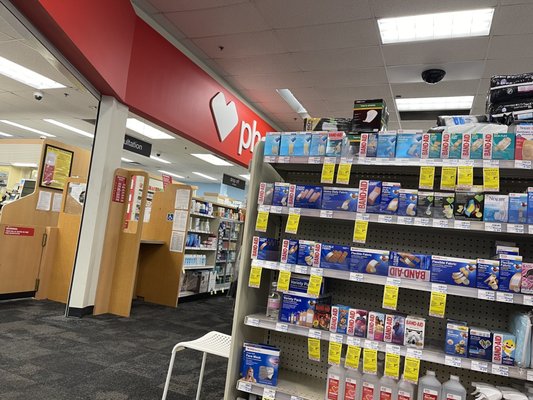
You are a GUI agent. You are given a task and a screenshot of the screen. Output one action in this format:
    pyautogui.click(x=<x>, y=<y>)
    Task: Click on the light
    This screenshot has height=400, width=533.
    Given the screenshot: What is the action you would take?
    pyautogui.click(x=430, y=100)